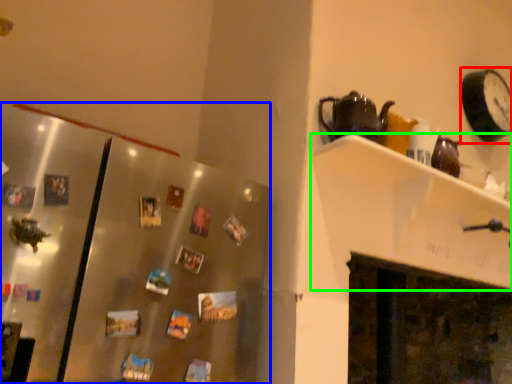
Question: Considering the real-world distances, which object is farthest from clock (highlighted by a red box)? glass door (highlighted by a blue box) or shelf (highlighted by a green box)?

Choices:
 (A) glass door
 (B) shelf

Answer: (A)